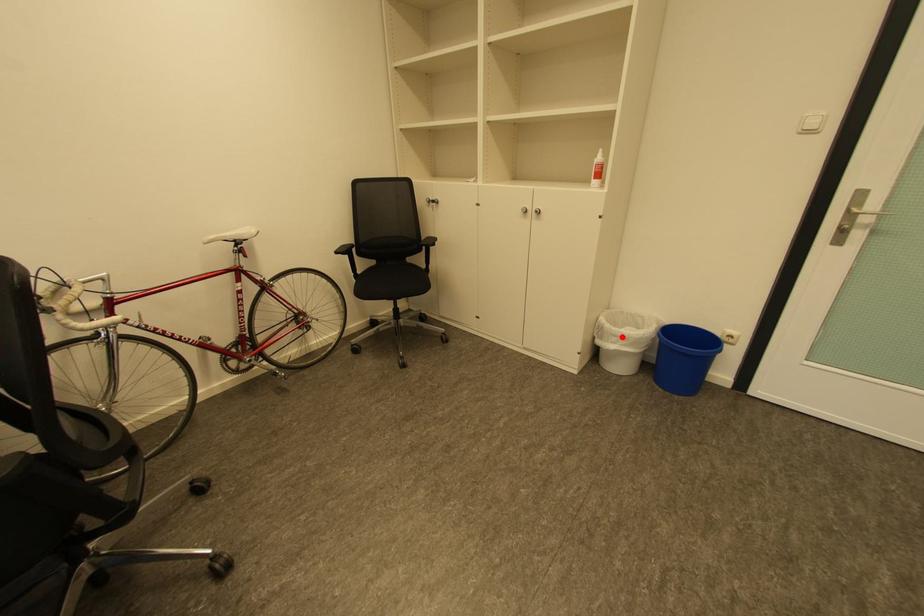
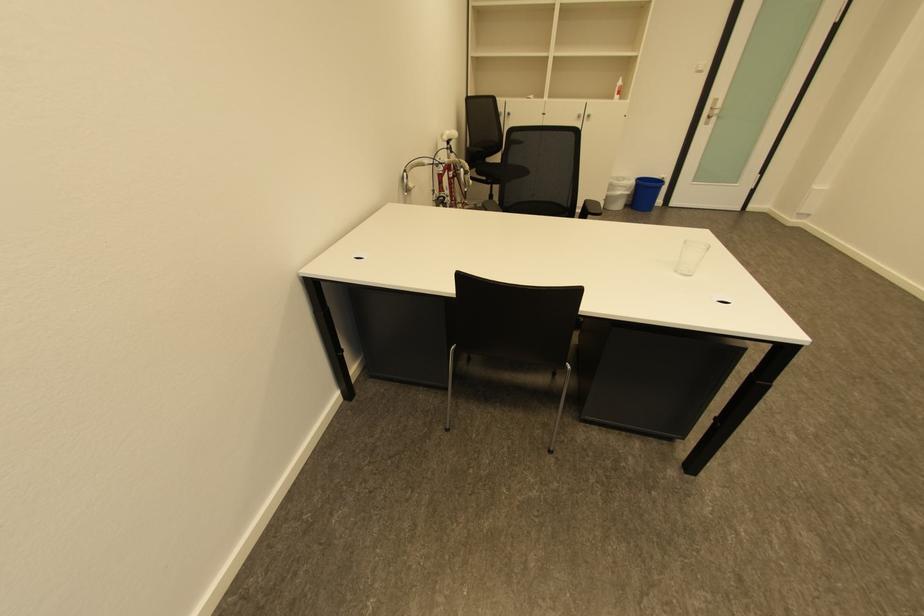
Question: I am providing you with two images of the same scene from different viewpoints. In image1, a red point is highlighted. Considering the same 3D point in image2, which of the following is correct?

Choices:
 (A) It is closer
 (B) It is farther

Answer: (A)